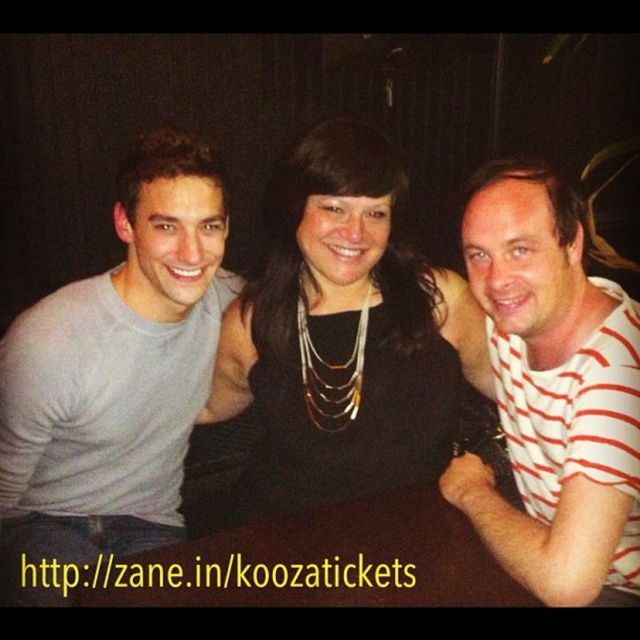
Question: Among these points, which one is nearest to the camera?

Choices:
 (A) (330, 404)
 (B) (554, 216)
 (C) (355, 596)

Answer: (C)

Question: Which point is closer to the camera?

Choices:
 (A) white striped shirt at center
 (B) black fabric dress at center
 (C) brown wooden table at center
 (D) gray cotton shirt at left

Answer: (A)

Question: Is black fabric dress at center positioned in front of white striped shirt at center?

Choices:
 (A) no
 (B) yes

Answer: (A)

Question: Can you confirm if gray cotton shirt at left is smaller than black fabric dress at center?

Choices:
 (A) no
 (B) yes

Answer: (B)

Question: Which object is closer to the camera taking this photo?

Choices:
 (A) black fabric dress at center
 (B) gray cotton shirt at left
 (C) brown wooden table at center

Answer: (C)

Question: Can you confirm if black fabric dress at center is wider than brown wooden table at center?

Choices:
 (A) yes
 (B) no

Answer: (A)